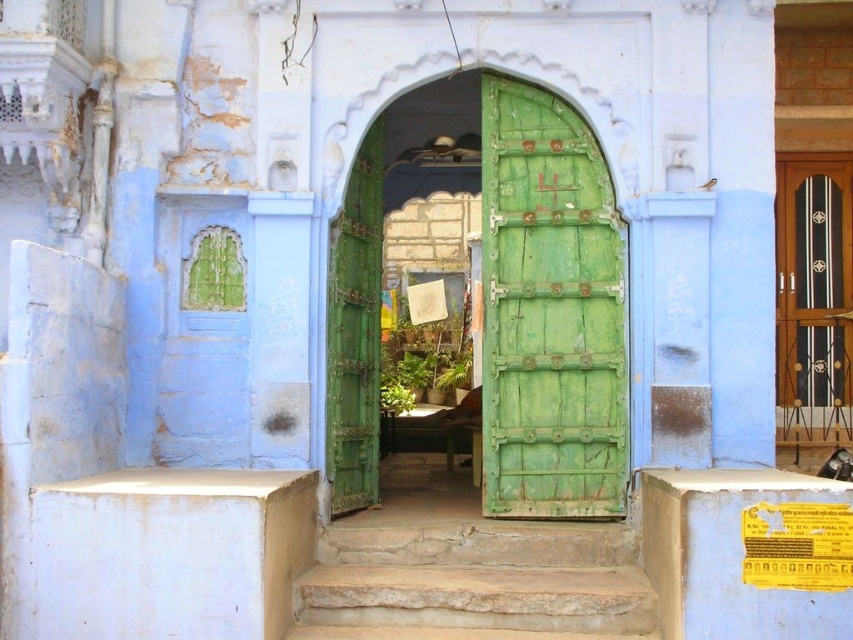
Question: Which point is farther to the camera?

Choices:
 (A) stone steps at center
 (B) green wooden door at center

Answer: (B)

Question: Can you confirm if green wooden door at center is smaller than green weathered wood door at center?

Choices:
 (A) no
 (B) yes

Answer: (A)

Question: Is green wooden door at center bigger than green weathered wood door at center?

Choices:
 (A) no
 (B) yes

Answer: (B)

Question: Does green weathered wood door at center have a larger size compared to stone steps at center?

Choices:
 (A) no
 (B) yes

Answer: (A)

Question: Which object is positioned closest to the green wooden door at center?

Choices:
 (A) green weathered wood door at center
 (B) stone steps at center

Answer: (A)

Question: Which point is closer to the camera?

Choices:
 (A) (595, 371)
 (B) (374, 412)
 (C) (544, 608)

Answer: (C)